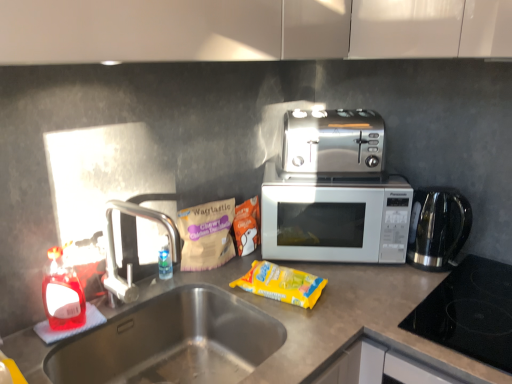
Question: Which direction should I rotate to look at yellow plastic packet at center, the first snack in the right-to-left sequence, — up or down?

Choices:
 (A) up
 (B) down

Answer: (B)

Question: Is matte brown packet of snacks at center, which is the second snack from left to right, positioned behind stainless steel sink at lower left?

Choices:
 (A) yes
 (B) no

Answer: (A)

Question: Is matte brown packet of snacks at center, which is the second snack from left to right, at the right side of stainless steel sink at lower left?

Choices:
 (A) yes
 (B) no

Answer: (A)

Question: Is matte brown packet of snacks at center, which is the second snack from left to right, at the left side of stainless steel sink at lower left?

Choices:
 (A) yes
 (B) no

Answer: (B)

Question: Would you say matte brown packet of snacks at center, which appears as the second snack when viewed from the right, is outside stainless steel sink at lower left?

Choices:
 (A) no
 (B) yes

Answer: (B)

Question: From the image's perspective, is matte brown packet of snacks at center, which appears as the second snack when viewed from the right, located beneath stainless steel sink at lower left?

Choices:
 (A) no
 (B) yes

Answer: (A)

Question: Can you confirm if matte brown packet of snacks at center, which appears as the second snack when viewed from the right, is shorter than stainless steel sink at lower left?

Choices:
 (A) no
 (B) yes

Answer: (B)

Question: Does satin silver toaster at center come in front of matte brown packet of snacks at center, which appears as the second snack when viewed from the right?

Choices:
 (A) yes
 (B) no

Answer: (A)

Question: Could you tell me if satin silver toaster at center is facing matte brown packet of snacks at center, which is the second snack from left to right?

Choices:
 (A) yes
 (B) no

Answer: (B)

Question: Is satin silver toaster at center with matte brown packet of snacks at center, which appears as the second snack when viewed from the right?

Choices:
 (A) yes
 (B) no

Answer: (B)

Question: Is satin silver toaster at center outside matte brown packet of snacks at center, which appears as the second snack when viewed from the right?

Choices:
 (A) yes
 (B) no

Answer: (A)

Question: Does satin silver toaster at center have a larger size compared to matte brown packet of snacks at center, which appears as the second snack when viewed from the right?

Choices:
 (A) no
 (B) yes

Answer: (B)

Question: From the image's perspective, would you say satin silver toaster at center is positioned over matte brown packet of snacks at center, which appears as the second snack when viewed from the right?

Choices:
 (A) yes
 (B) no

Answer: (A)

Question: Is satin silver toaster at center smaller than silver metallic faucet at left?

Choices:
 (A) no
 (B) yes

Answer: (A)